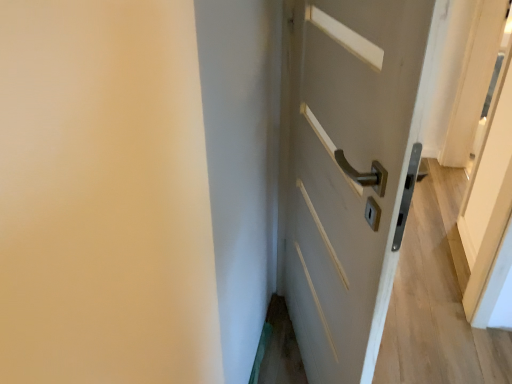
In the scene shown: Measure the distance between white wood door at right and camera.

A distance of 23.06 inches exists between white wood door at right and camera.

Identify the location of white wood door at right. (348, 174).

Describe the element at coordinates (348, 174) in the screenshot. I see `white wood door at right` at that location.

Where is `white wood door at right`? white wood door at right is located at coordinates (348, 174).